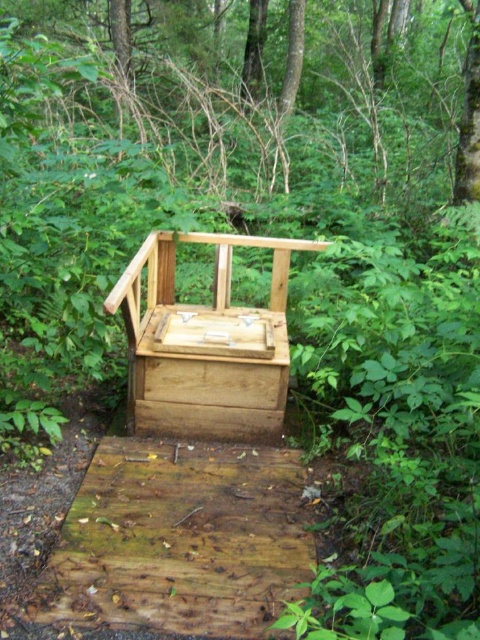
Does brown wood tree at upper center have a smaller size compared to natural wood chair at center?

Indeed, brown wood tree at upper center has a smaller size compared to natural wood chair at center.

Looking at this image, is brown wood tree at upper center to the right of natural wood chair at center from the viewer's perspective?

No, brown wood tree at upper center is not to the right of natural wood chair at center.

Find the location of a particular element. brown wood tree at upper center is located at coordinates (295, 81).

The height and width of the screenshot is (640, 480). What are the coordinates of `brown wood tree at upper center` in the screenshot? It's located at (295, 81).